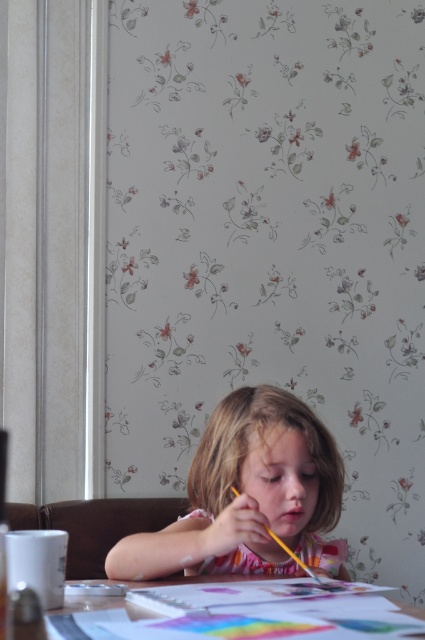
Question: Does smooth pink dress at center lie behind smooth paper at lower center?

Choices:
 (A) yes
 (B) no

Answer: (A)

Question: Does smooth pink dress at center have a smaller size compared to yellow matte crayon at center?

Choices:
 (A) no
 (B) yes

Answer: (A)

Question: Which point appears closest to the camera in this image?

Choices:
 (A) (309, 600)
 (B) (193, 474)

Answer: (A)

Question: Which object is the farthest from the smooth paper at lower center?

Choices:
 (A) yellow matte crayon at center
 (B) smooth pink dress at center

Answer: (A)

Question: Which of the following is the closest to the observer?

Choices:
 (A) (229, 403)
 (B) (235, 493)
 (C) (306, 584)

Answer: (C)

Question: Is smooth pink dress at center behind yellow matte crayon at center?

Choices:
 (A) yes
 (B) no

Answer: (A)